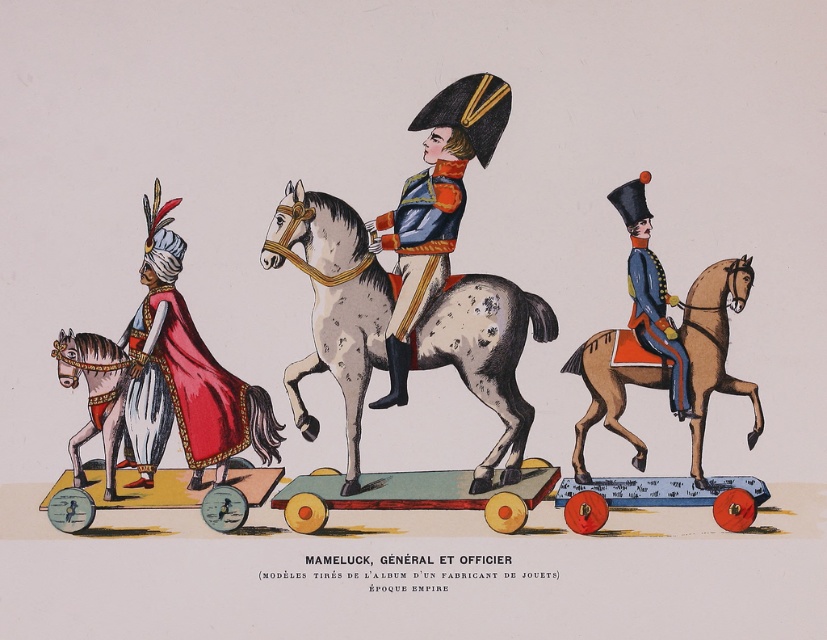
Can you confirm if matte red cape at left is positioned above blue glossy uniform at center?

No, matte red cape at left is not above blue glossy uniform at center.

Which of these two, matte red cape at left or blue glossy uniform at center, stands shorter?

matte red cape at left is shorter.

Measure the distance between point (156,189) and camera.

63.52 meters

This screenshot has height=640, width=827. Find the location of `matte red cape at left`. matte red cape at left is located at coordinates (184, 372).

From the picture: Does shiny blue uniform at center have a larger size compared to blue glossy uniform at center?

Correct, shiny blue uniform at center is larger in size than blue glossy uniform at center.

The image size is (827, 640). In order to click on shiny blue uniform at center in this screenshot , I will do `click(434, 205)`.

The height and width of the screenshot is (640, 827). Find the location of `shiny blue uniform at center`. shiny blue uniform at center is located at coordinates (434, 205).

Is point (352, 342) positioned after point (638, 211)?

No, it is in front of (638, 211).

Is speckled gray horse at center bigger than blue glossy uniform at center?

Yes, speckled gray horse at center is bigger than blue glossy uniform at center.

Which is in front, point (436, 333) or point (680, 397)?

Point (436, 333)

Locate an element on the screen. The height and width of the screenshot is (640, 827). speckled gray horse at center is located at coordinates (333, 305).